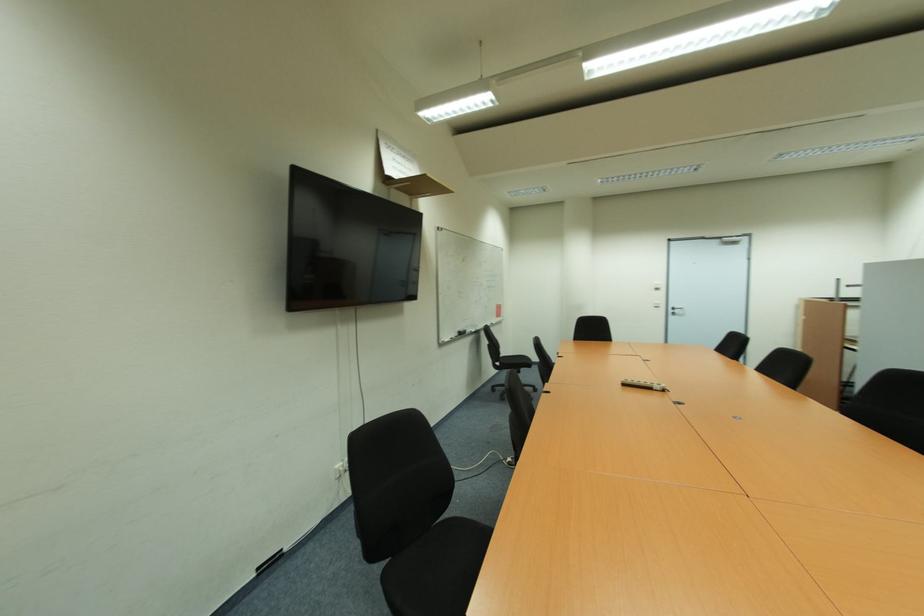
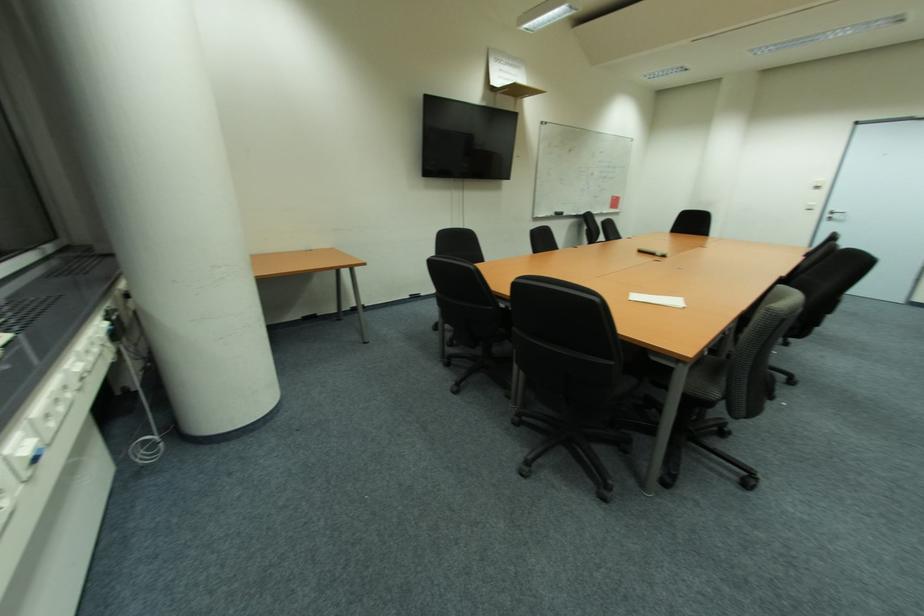
Locate, in the second image, the point that corresponds to [679,312] in the first image.

(842, 217)